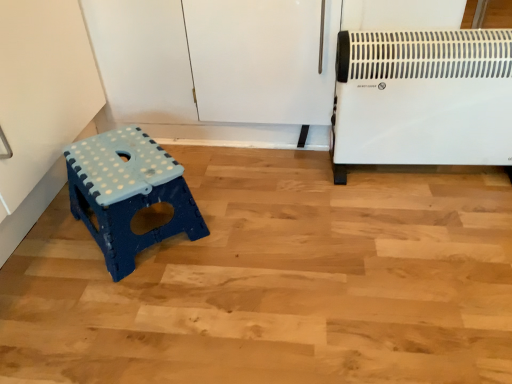
Question: Considering the relative positions of white plastic heater at right and blue plastic stool at lower left in the image provided, is white plastic heater at right to the left or to the right of blue plastic stool at lower left?

Choices:
 (A) left
 (B) right

Answer: (B)

Question: Is white plastic heater at right inside or outside of blue plastic stool at lower left?

Choices:
 (A) outside
 (B) inside

Answer: (A)

Question: Looking at their shapes, would you say white plastic heater at right is wider or thinner than blue plastic stool at lower left?

Choices:
 (A) thin
 (B) wide

Answer: (A)

Question: From the image's perspective, is blue plastic stool at lower left positioned above or below white plastic heater at right?

Choices:
 (A) above
 (B) below

Answer: (B)

Question: Considering the positions of blue plastic stool at lower left and white plastic heater at right in the image, is blue plastic stool at lower left taller or shorter than white plastic heater at right?

Choices:
 (A) short
 (B) tall

Answer: (A)

Question: Is point (143, 173) closer or farther from the camera than point (404, 135)?

Choices:
 (A) closer
 (B) farther

Answer: (A)

Question: Based on their positions, is blue plastic stool at lower left located to the left or right of white plastic heater at right?

Choices:
 (A) right
 (B) left

Answer: (B)